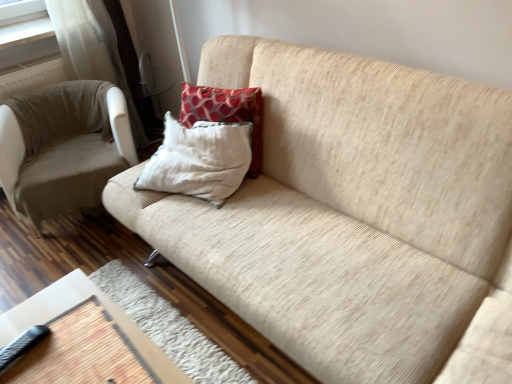
Where is `empty space that is to the right of black rubberized remote at lower left`? This screenshot has width=512, height=384. empty space that is to the right of black rubberized remote at lower left is located at coordinates (67, 354).